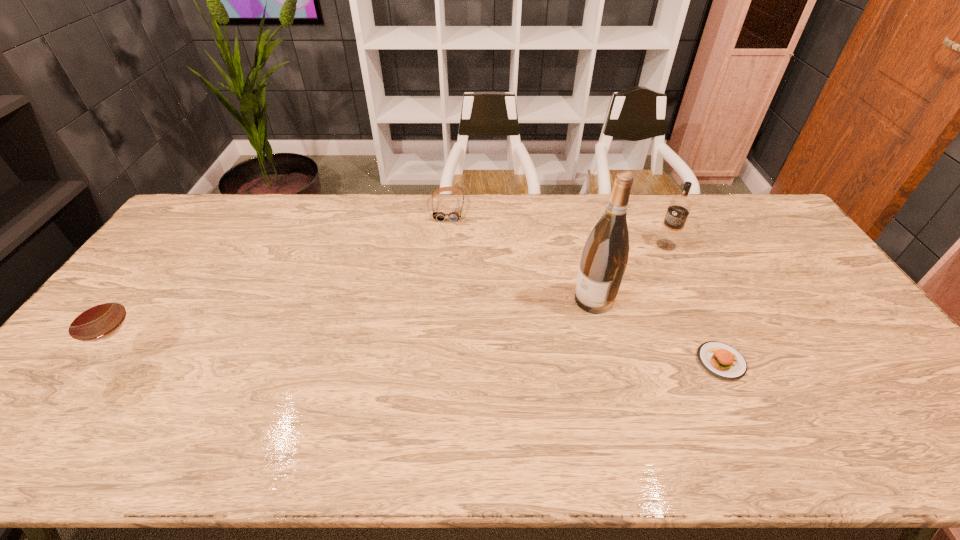
Where is `object positioned at the far edge`? object positioned at the far edge is located at coordinates (455, 214).

Identify the location of wineglass that is positioned at the near edge. (96, 316).

You are a GUI agent. You are given a task and a screenshot of the screen. Output one action in this format:
    pyautogui.click(x=<x>, y=<y>)
    Task: Click on the food at the near edge
    
    Given the screenshot: What is the action you would take?
    pyautogui.click(x=720, y=359)

Where is `object that is positioned at the left edge`? Image resolution: width=960 pixels, height=540 pixels. object that is positioned at the left edge is located at coordinates (96, 316).

I want to click on object located at the near left corner, so click(96, 316).

Find the location of a particular element. This screenshot has width=960, height=540. vacant space at the far edge of the desktop is located at coordinates (648, 227).

I want to click on vacant area at the near edge of the desktop, so click(x=351, y=396).

You are a GUI agent. You are given a task and a screenshot of the screen. Output one action in this format:
    pyautogui.click(x=<x>, y=<y>)
    Task: Click on the free space at the left edge of the desktop
    
    Given the screenshot: What is the action you would take?
    pyautogui.click(x=111, y=370)

At what (x,y) coordinates should I click in order to perform the action: click on vacant space at the right edge. Please return your answer as a coordinate pair (x, y). The height and width of the screenshot is (540, 960). Looking at the image, I should click on (799, 252).

You are a GUI agent. You are given a task and a screenshot of the screen. Output one action in this format:
    pyautogui.click(x=<x>, y=<y>)
    Task: Click on the free space at the near right corner of the desktop
    
    Given the screenshot: What is the action you would take?
    pyautogui.click(x=853, y=393)